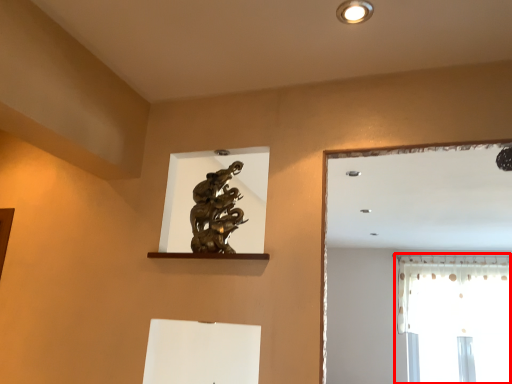
Question: From the image's perspective, where is window (annotated by the red box) located relative to lighting?

Choices:
 (A) above
 (B) below

Answer: (B)